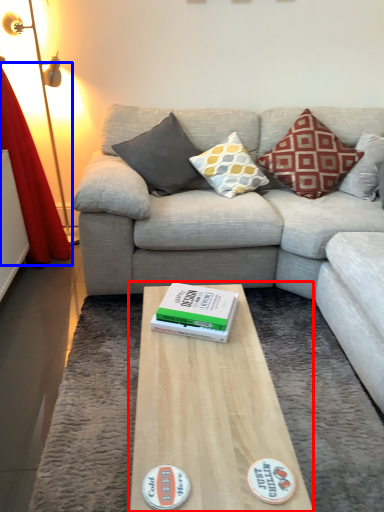
Question: Which point is closer to the camera, coffee table (highlighted by a red box) or curtain (highlighted by a blue box)?

Choices:
 (A) coffee table
 (B) curtain

Answer: (A)